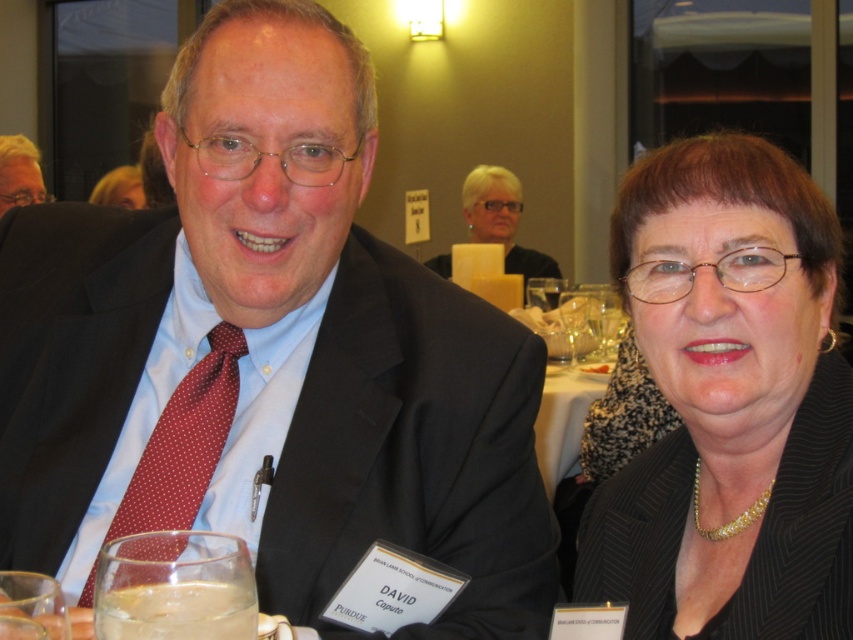
You are organizing a charity event and need to arrange seating based on the width of the attendees clothing. You see the matte black suit at center and the red dotted tie at left. Which clothing item has a greater width?

The matte black suit at center has a greater width than the red dotted tie at left according to the description.

Please provide the 2D coordinates of the red dotted tie at left in the image. The coordinates should be in the format of a tuple with two decimal numbers separated by a comma, enclosed in parentheses. The first number represents the x coordinate, and the second number represents the y coordinate. For example, if the coordinates are 0.5 and 0.3, the answer should be written as follows. Answer with the exact coordinates provided in the description. Answer with the exact coordinates provided in the Objects Des

The 2D coordinates of the red dotted tie at left are exactly at point (x=184, y=442) as given in the description.